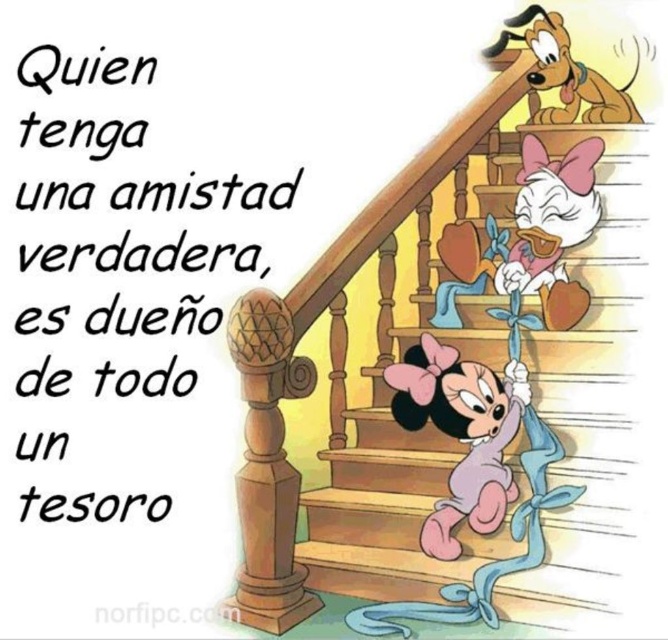
Is pink fabric dress at center further to the viewer compared to pink fabric minnie mouse at center?

Yes, it is behind pink fabric minnie mouse at center.

Who is taller, pink fabric dress at center or pink fabric minnie mouse at center?

Standing taller between the two is pink fabric minnie mouse at center.

Which is in front, point (546, 205) or point (478, 476)?

Point (478, 476) is in front.

Where is `pink fabric dress at center`? This screenshot has height=640, width=668. pink fabric dress at center is located at coordinates (526, 241).

Is wooden stairs at center shorter than brown plush dog at upper right?

No.

Which is above, wooden stairs at center or brown plush dog at upper right?

brown plush dog at upper right

Describe the element at coordinates (490, 401) in the screenshot. I see `wooden stairs at center` at that location.

Locate an element on the screen. wooden stairs at center is located at coordinates (490, 401).

Who is lower down, wooden stairs at center or pink fabric dress at center?

wooden stairs at center is lower down.

From the picture: Is the position of wooden stairs at center less distant than that of pink fabric dress at center?

Yes.

This screenshot has height=640, width=668. In order to click on wooden stairs at center in this screenshot , I will do `click(490, 401)`.